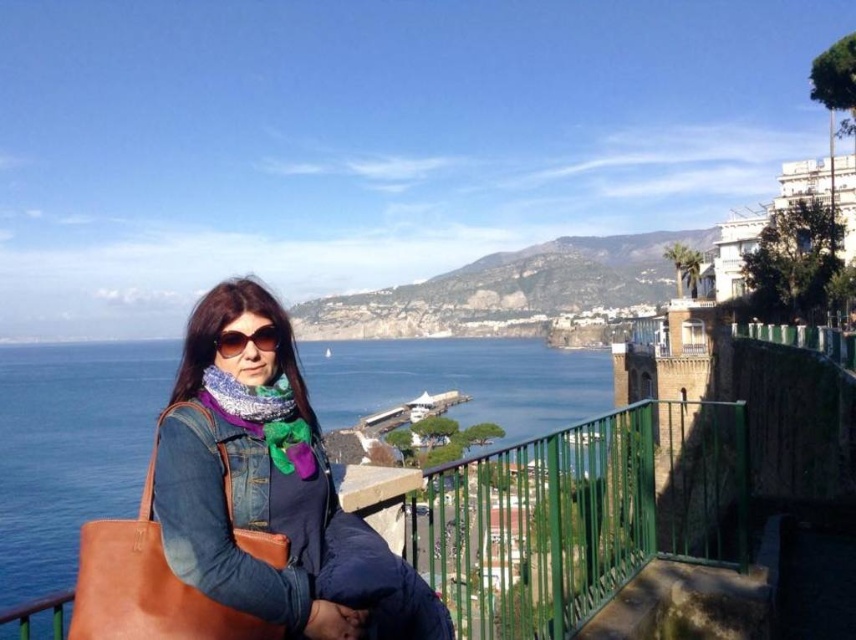
You are a photographer trying to capture the person in the scene. You notice the knitted multicolor scarf at center and the sunglasses at center. Which object should you focus on to ensure the person is clearly visible in your photo?

The knitted multicolor scarf at center is in front of the sunglasses at center. To ensure the person is clearly visible, focus on the sunglasses at center since it is closer to the face and less obstructed by the scarf.

You are a photographer trying to capture the coastal view. You notice the blue water at center and the knitted multicolor scarf at center. Which object would appear bigger in your photo if you focus on the center of the image?

The blue water at center would appear bigger in the photo because it has a larger size compared to the knitted multicolor scarf at center.